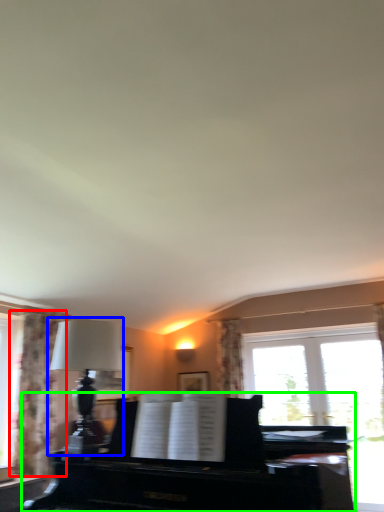
Question: Considering the real-world distances, which object is farthest from curtain (highlighted by a red box)? table lamp (highlighted by a blue box) or piano (highlighted by a green box)?

Choices:
 (A) table lamp
 (B) piano

Answer: (B)